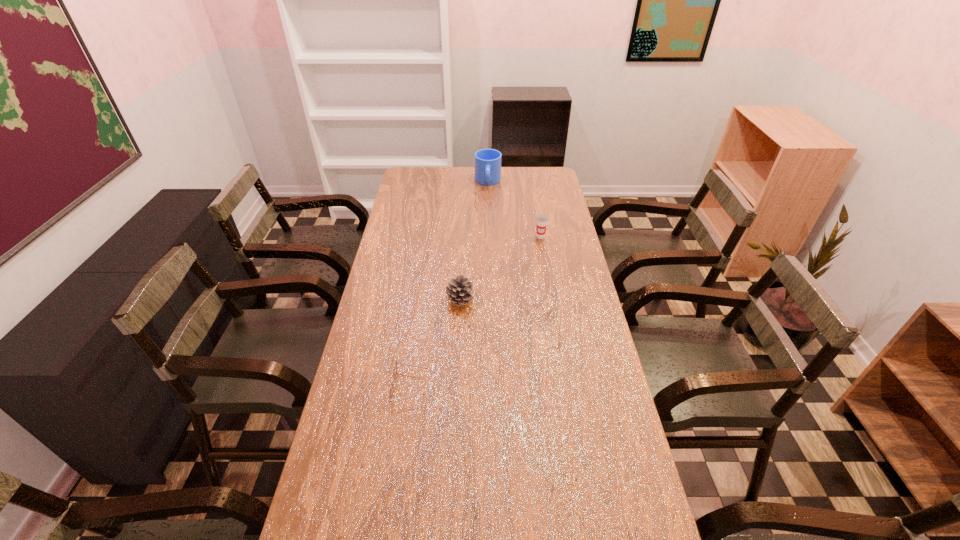
Where is `vacant space located on the front-facing side of the spectacles`? The image size is (960, 540). vacant space located on the front-facing side of the spectacles is located at coordinates (502, 387).

Identify the location of object that is positioned at the far edge. (487, 161).

Find the location of a particular element. object situated at the left edge is located at coordinates (395, 365).

Where is `object that is positioned at the right edge`? This screenshot has height=540, width=960. object that is positioned at the right edge is located at coordinates [x=542, y=220].

Where is `free space at the far edge of the desktop`? This screenshot has height=540, width=960. free space at the far edge of the desktop is located at coordinates (517, 183).

Image resolution: width=960 pixels, height=540 pixels. Find the location of `vacant space at the left edge of the desktop`. vacant space at the left edge of the desktop is located at coordinates (345, 534).

Find the location of a particular element. Image resolution: width=960 pixels, height=540 pixels. free space at the right edge is located at coordinates (553, 294).

At what (x,y) coordinates should I click in order to perform the action: click on blank space at the far right corner of the desktop. Please return your answer as a coordinate pair (x, y). This screenshot has width=960, height=540. Looking at the image, I should click on (546, 171).

This screenshot has height=540, width=960. Find the location of `unoccupied area between the third tallest object and the cup`. unoccupied area between the third tallest object and the cup is located at coordinates (500, 268).

The width and height of the screenshot is (960, 540). Find the location of `free space between the farthest object and the second nearest object`. free space between the farthest object and the second nearest object is located at coordinates (474, 241).